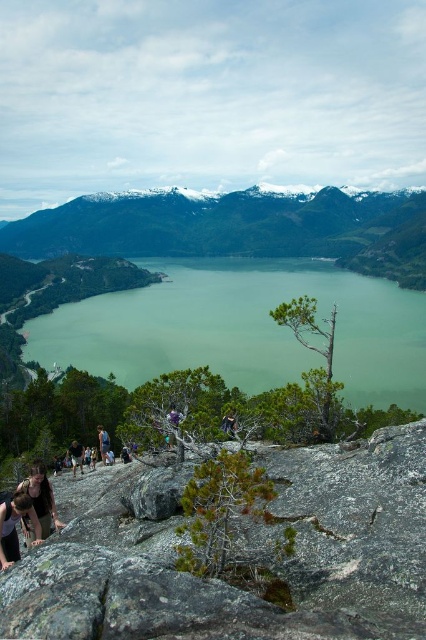
You are planning to cross the greenish water at center to reach the other side. Considering the width of the dark brown leather jacket at lower left, can you estimate if the water is wide enough for you to cross without any equipment?

The greenish water at center is wider than the dark brown leather jacket at lower left, so it might be wider than expected. Without knowing your exact crossing capability, it is advisable to proceed with caution or seek a safer route.

You are a hiker looking at the scene and want to know the position of the two hikers wearing matte black shirt at lower left and dark blue shirt at center. Which one is positioned more to the left side of the image?

The matte black shirt at lower left is positioned to the left of dark blue shirt at center, so the matte black shirt at lower left is more to the left side of the image.

You are planning to hike up the trail and need to cross the greenish water at center and the dark brown leather jacket at lower left. Which object will you encounter first along your path?

The dark brown leather jacket at lower left will be encountered first because it is located lower in the scene, which typically corresponds to being closer to the starting point of an ascending path.